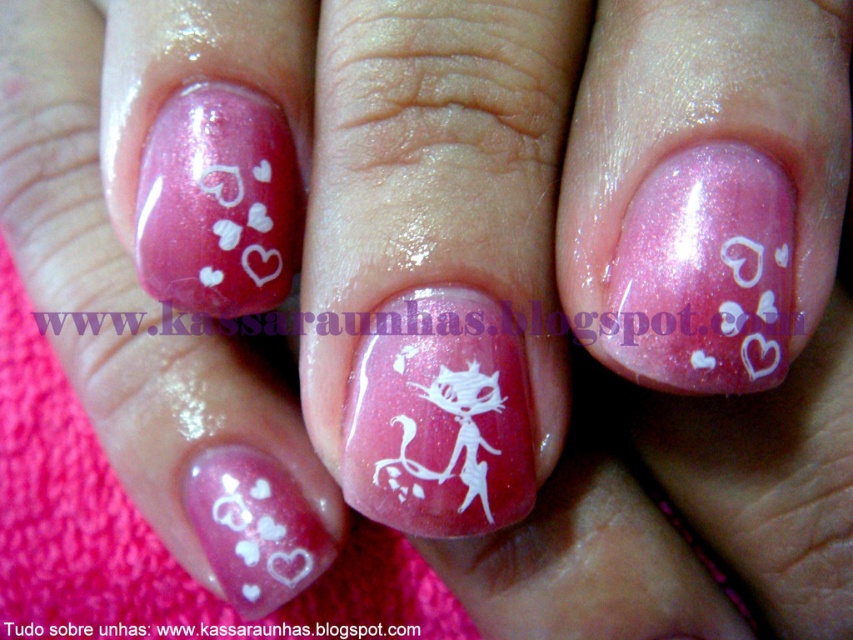
Question: Can you confirm if white glossy cat at center is thinner than pink glossy hearts at upper left?

Choices:
 (A) yes
 (B) no

Answer: (B)

Question: Which object is the closest to the white glossy cat at center?

Choices:
 (A) pink glossy hearts at upper left
 (B) pink glitter nail polish at center

Answer: (B)

Question: Among these objects, which one is farthest from the camera?

Choices:
 (A) white glossy cat at center
 (B) pink glossy hearts at upper left

Answer: (B)

Question: Can you confirm if pink glitter nail polish at center is smaller than white glossy cat at center?

Choices:
 (A) no
 (B) yes

Answer: (B)

Question: Can you confirm if pink glitter nail polish at center is positioned to the right of white glossy cat at center?

Choices:
 (A) no
 (B) yes

Answer: (B)

Question: Which point is farther from the camera taking this photo?

Choices:
 (A) (206, 253)
 (B) (379, 355)
 (C) (697, 252)

Answer: (A)